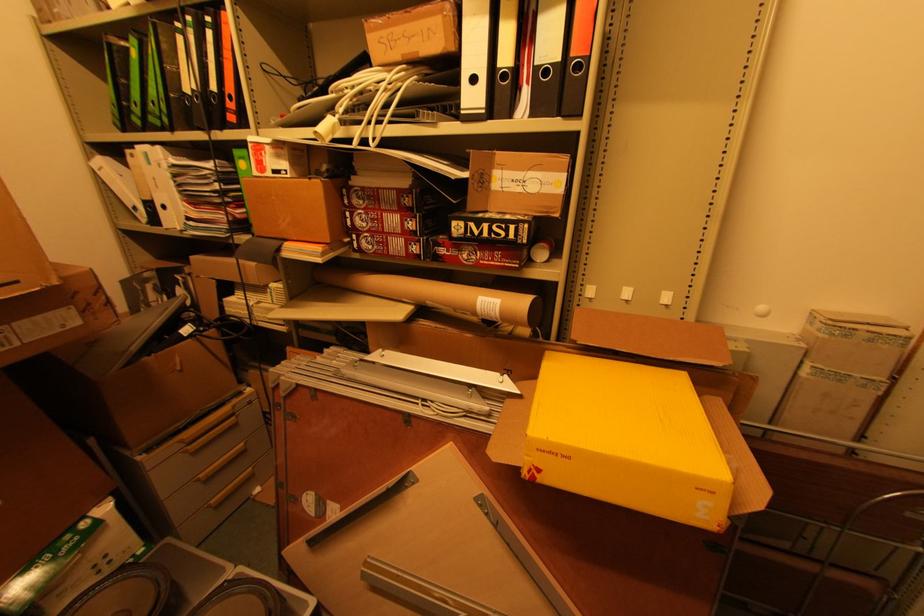
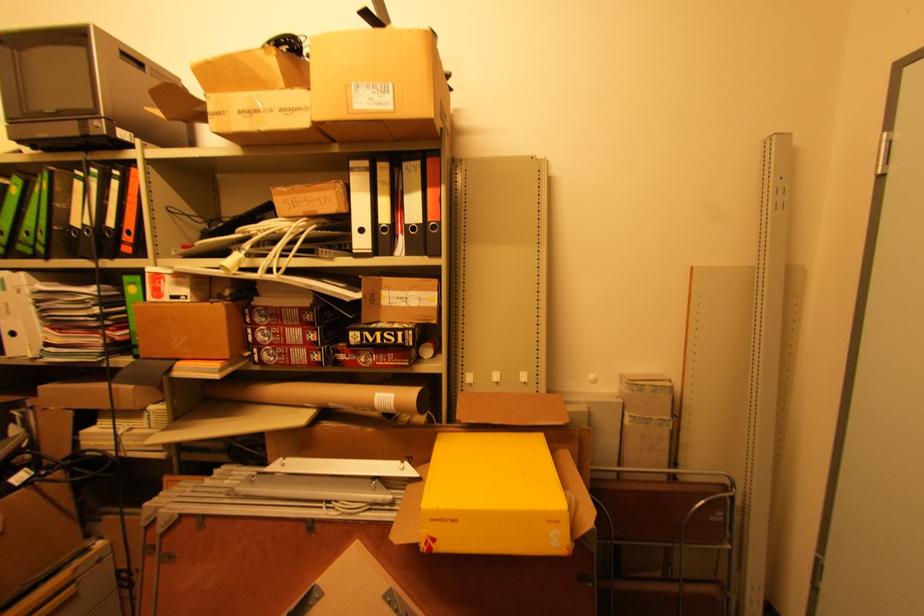
Where in the second image is the point corresponding to (x=489, y=185) from the first image?

(380, 302)